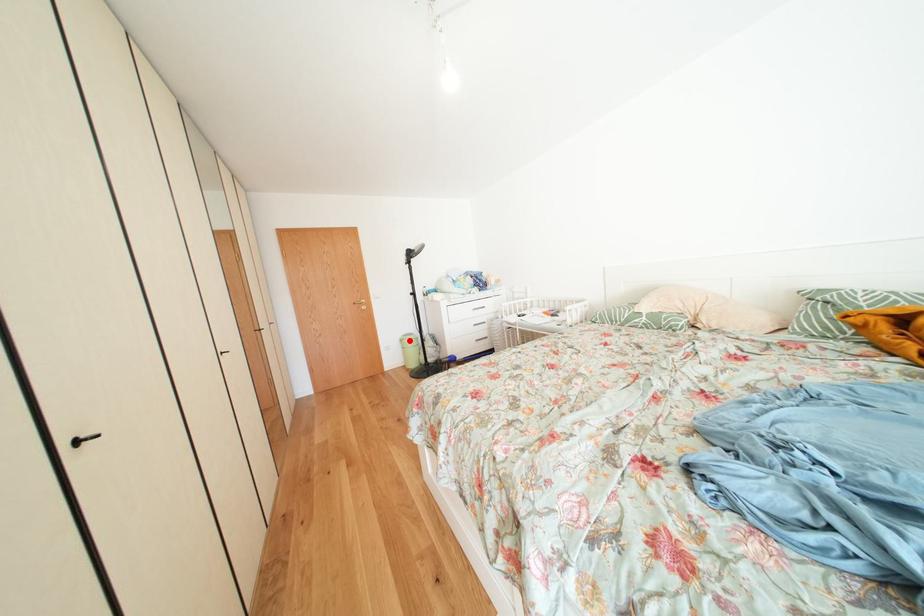
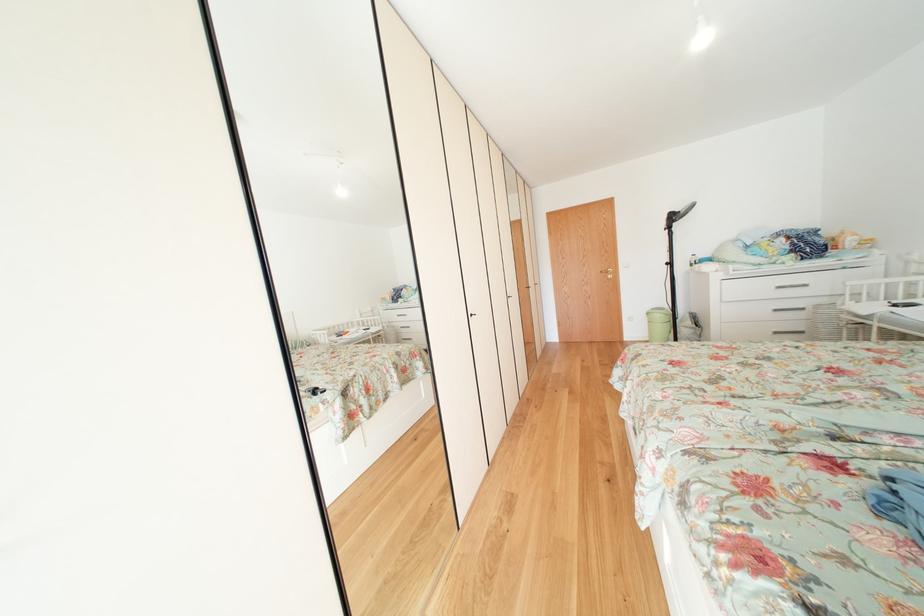
Question: I am providing you with two images of the same scene from different viewpoints. Image1 has a red point marked. In image2, the corresponding 3D location appears at what relative position? Reply with the corresponding letter.

Choices:
 (A) Closer
 (B) Farther

Answer: (A)